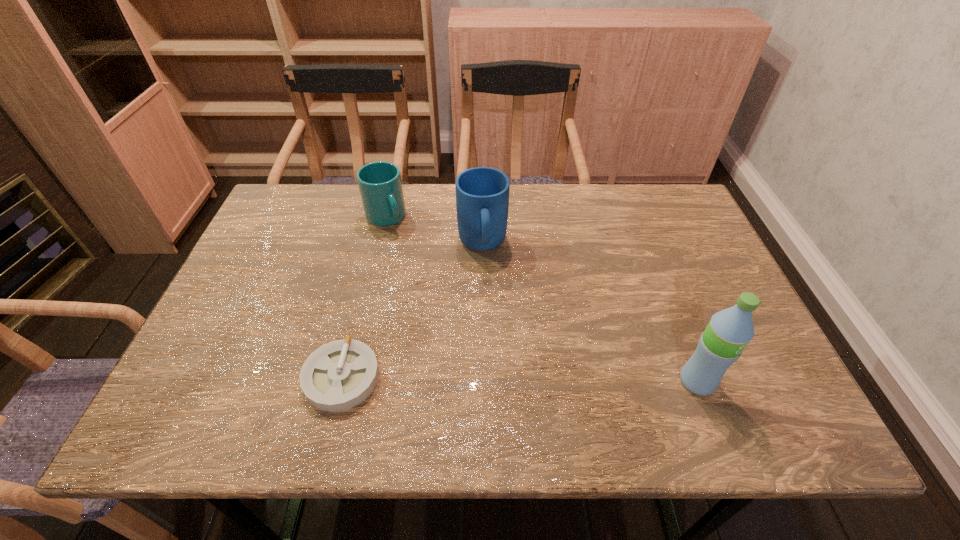
Where is `the shortest object`? The image size is (960, 540). the shortest object is located at coordinates (339, 375).

Find the location of a particular element. The width and height of the screenshot is (960, 540). the rightmost object is located at coordinates (729, 331).

I want to click on the tallest object, so click(x=729, y=331).

The height and width of the screenshot is (540, 960). What are the coordinates of `the third object from left to right` in the screenshot? It's located at (482, 193).

Locate an element on the screen. This screenshot has height=540, width=960. mug is located at coordinates (482, 193).

Where is `cup`? The image size is (960, 540). cup is located at coordinates (380, 185).

I want to click on free space located 0.050m on the right of the ashtray, so click(402, 377).

This screenshot has width=960, height=540. Find the location of `vacant space located on the side of the second object from right to left with the handle`. vacant space located on the side of the second object from right to left with the handle is located at coordinates (495, 376).

The image size is (960, 540). Find the location of `free space located on the side of the second object from right to left with the handle`. free space located on the side of the second object from right to left with the handle is located at coordinates (494, 368).

The height and width of the screenshot is (540, 960). In order to click on vacant space located on the side of the second object from right to left with the handle in this screenshot , I will do `click(496, 384)`.